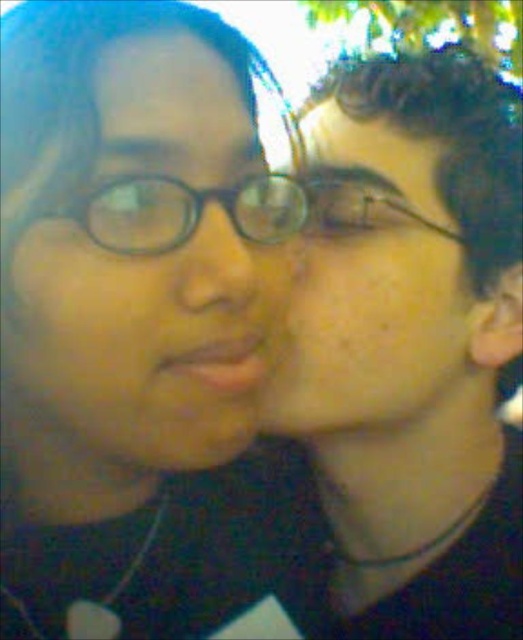
Question: Which object appears farthest from the camera in this image?

Choices:
 (A) matte glass nose at center
 (B) smooth skin face at center

Answer: (B)

Question: Which of the following is the farthest from the observer?

Choices:
 (A) matte glass nose at center
 (B) black plastic glasses at center

Answer: (A)

Question: Is smooth skin face at center in front of matte glass nose at center?

Choices:
 (A) yes
 (B) no

Answer: (B)

Question: Does smooth skin face at right appear on the left side of black plastic glasses at center?

Choices:
 (A) yes
 (B) no

Answer: (B)

Question: Considering the relative positions of smooth skin face at center and matte glass nose at center in the image provided, where is smooth skin face at center located with respect to matte glass nose at center?

Choices:
 (A) right
 (B) left

Answer: (A)

Question: Which of the following is the farthest from the observer?

Choices:
 (A) matte glass nose at center
 (B) black plastic glasses at center
 (C) smooth skin face at center
 (D) matte black glasses at left

Answer: (C)